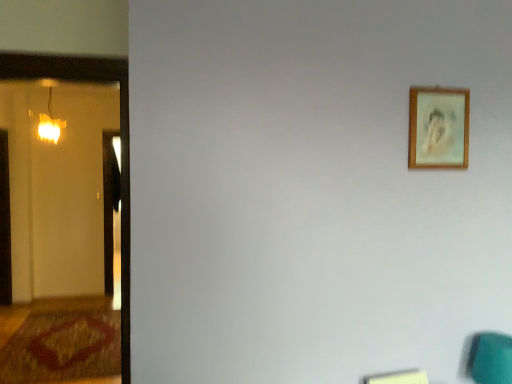
The image size is (512, 384). I want to click on vacant space situated above teal fabric swivel chair at lower right (from a real-world perspective), so click(497, 340).